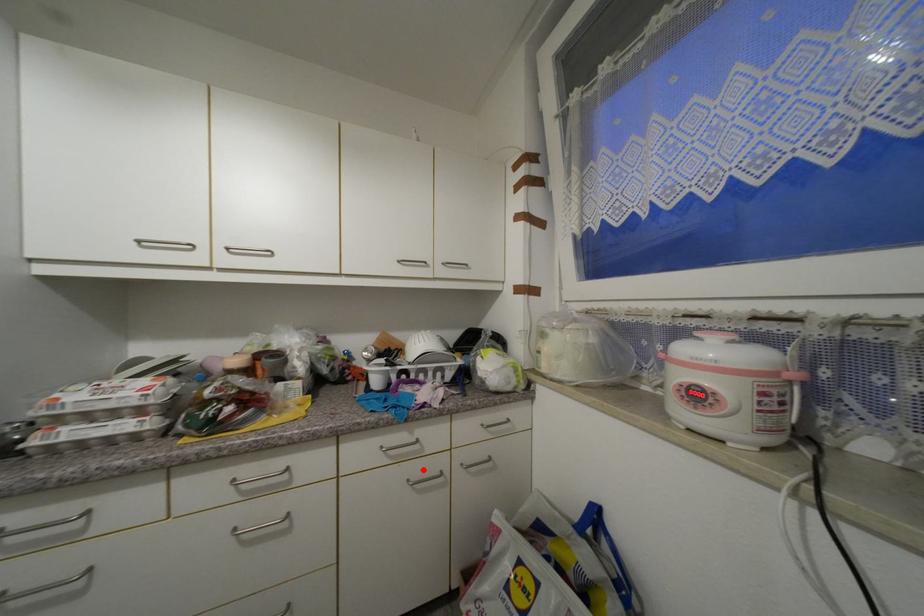
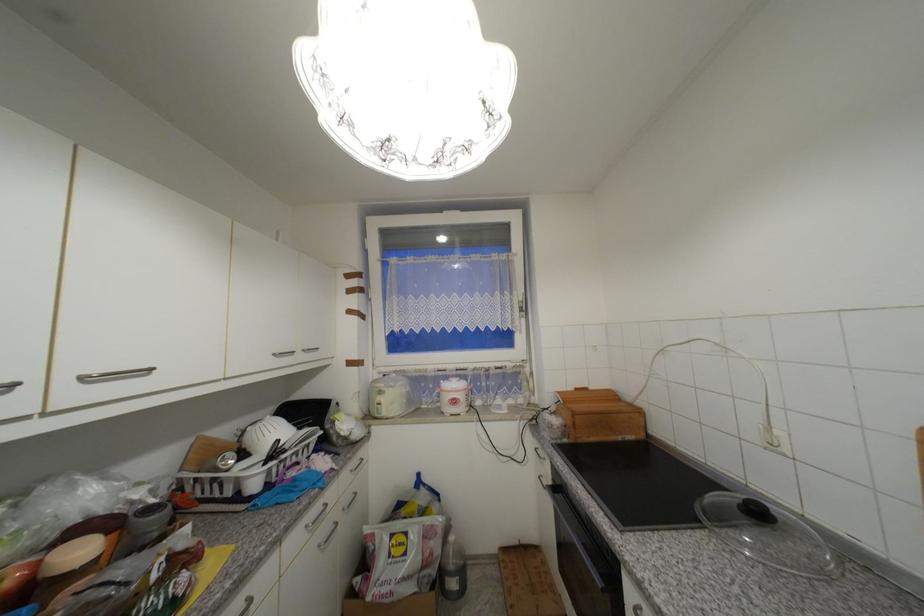
Question: I am providing you with two images of the same scene from different viewpoints. A red point is shown in image1. For the corresponding object point in image2, is it positioned nearer or farther from the camera?

Choices:
 (A) Nearer
 (B) Farther

Answer: (A)